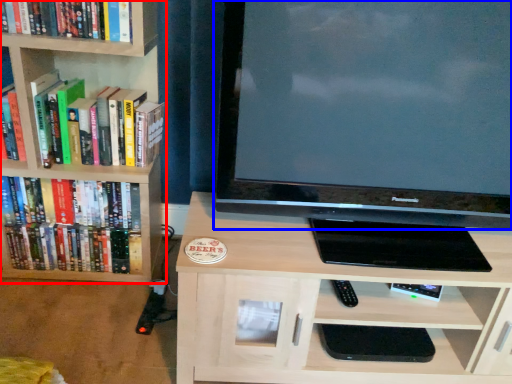
Question: Among these objects, which one is nearest to the camera, bookcase (highlighted by a red box) or television (highlighted by a blue box)?

Choices:
 (A) bookcase
 (B) television

Answer: (B)